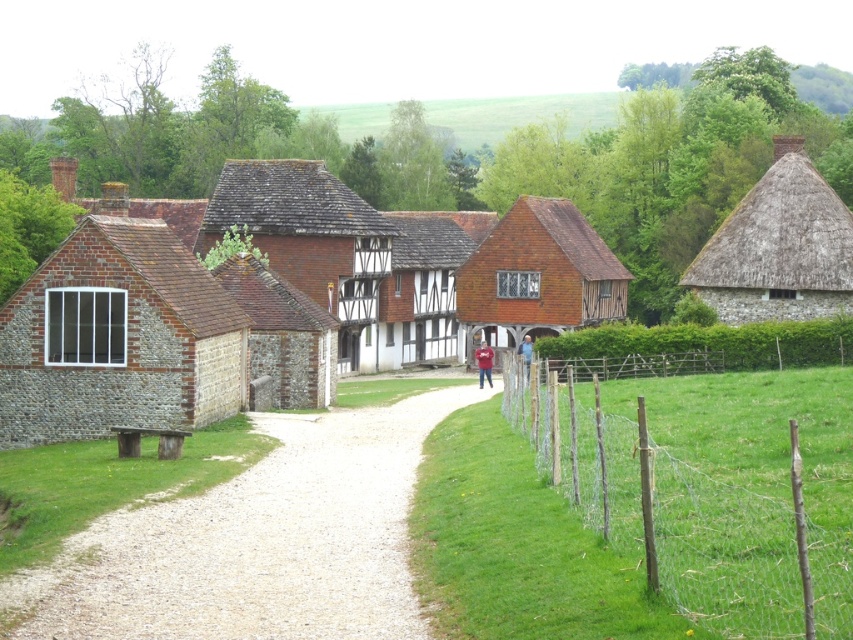
You are a visitor arriving at this rural area and want to take a photo of both the brick stone cottage at left and the brick wall at center. Since you have a wide angle lens, which object should you stand closer to in order to capture both in the frame?

Since the brick stone cottage at left is bigger than the brick wall at center, you should stand closer to the brick wall at center to ensure both objects fit within the frame.